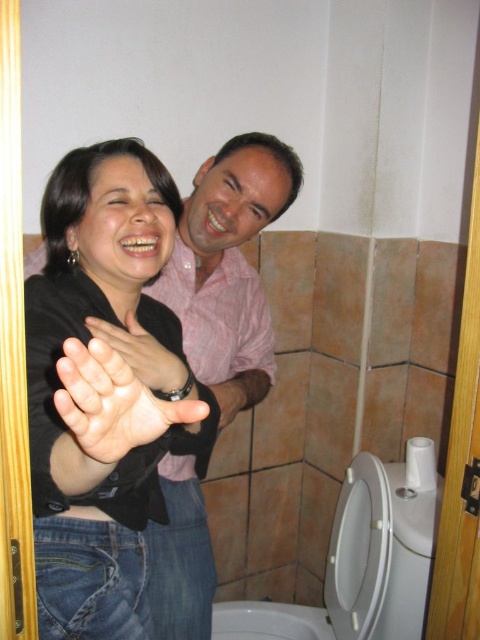
Which is below, smooth skin hand at center or matte black hand at center?

smooth skin hand at center is below.

Which of these two, smooth skin hand at center or matte black hand at center, stands shorter?

With less height is matte black hand at center.

You are a GUI agent. You are given a task and a screenshot of the screen. Output one action in this format:
    pyautogui.click(x=<x>, y=<y>)
    Task: Click on the smooth skin hand at center
    
    Given the screenshot: What is the action you would take?
    pyautogui.click(x=121, y=360)

Does point (156, 340) come in front of point (216, 634)?

Yes, it is in front of point (216, 634).

Does black matte shirt at center have a smaller size compared to white glossy toilet bowl at lower center?

Actually, black matte shirt at center might be larger than white glossy toilet bowl at lower center.

Is point (97, 314) in front of point (268, 637)?

Yes, point (97, 314) is closer to viewer.

This screenshot has height=640, width=480. What are the coordinates of `black matte shirt at center` in the screenshot? It's located at (107, 358).

Is pink cotton shirt at upper center taller than matte black hand at center?

Correct, pink cotton shirt at upper center is much taller as matte black hand at center.

Between pink cotton shirt at upper center and matte black hand at center, which one is positioned higher?

matte black hand at center is higher up.

Is point (193, 288) closer to viewer compared to point (180, 371)?

No, it is behind (180, 371).

This screenshot has height=640, width=480. What are the coordinates of `pink cotton shirt at upper center` in the screenshot? It's located at (228, 268).